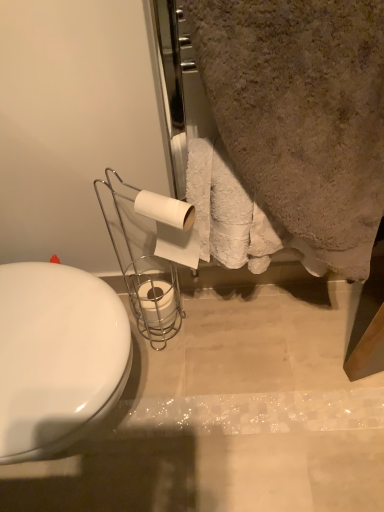
Question: Considering the relative sizes of white matte toilet paper at center, the 1th toilet paper from the back, and white matte toilet paper at center, positioned as the second toilet paper in bottom-to-top order, in the image provided, is white matte toilet paper at center, the 1th toilet paper from the back, taller than white matte toilet paper at center, positioned as the second toilet paper in bottom-to-top order,?

Choices:
 (A) no
 (B) yes

Answer: (A)

Question: Considering the relative positions of white matte toilet paper at center, which appears as the first toilet paper when ordered from the bottom, and white matte toilet paper at center, positioned as the 1th toilet paper in top-to-bottom order, in the image provided, is white matte toilet paper at center, which appears as the first toilet paper when ordered from the bottom, to the right of white matte toilet paper at center, positioned as the 1th toilet paper in top-to-bottom order, from the viewer's perspective?

Choices:
 (A) yes
 (B) no

Answer: (B)

Question: From a real-world perspective, is white matte toilet paper at center, which appears as the first toilet paper when ordered from the bottom, below white matte toilet paper at center, positioned as the second toilet paper in bottom-to-top order?

Choices:
 (A) yes
 (B) no

Answer: (A)

Question: Does white matte toilet paper at center, the 1th toilet paper from the back, have a lesser height compared to white matte toilet paper at center, positioned as the 1th toilet paper in top-to-bottom order?

Choices:
 (A) yes
 (B) no

Answer: (A)

Question: Is white matte toilet paper at center, the 1th toilet paper from the back, located outside white matte toilet paper at center, positioned as the second toilet paper in bottom-to-top order?

Choices:
 (A) yes
 (B) no

Answer: (A)

Question: Considering the positions of white glossy toilet at left and beige textured towel at upper right in the image, is white glossy toilet at left bigger or smaller than beige textured towel at upper right?

Choices:
 (A) big
 (B) small

Answer: (B)

Question: Would you say white glossy toilet at left is to the left or to the right of beige textured towel at upper right in the picture?

Choices:
 (A) left
 (B) right

Answer: (A)

Question: From a real-world perspective, is white glossy toilet at left physically located above or below beige textured towel at upper right?

Choices:
 (A) below
 (B) above

Answer: (A)

Question: Looking at their shapes, would you say white glossy toilet at left is wider or thinner than beige textured towel at upper right?

Choices:
 (A) thin
 (B) wide

Answer: (B)

Question: Does point (157, 283) appear closer or farther from the camera than point (100, 337)?

Choices:
 (A) closer
 (B) farther

Answer: (B)

Question: Is white matte toilet paper at center, the 1th toilet paper from the back, wider or thinner than white glossy toilet at left?

Choices:
 (A) wide
 (B) thin

Answer: (B)

Question: Considering the positions of white matte toilet paper at center, the 2th toilet paper in the front-to-back sequence, and white glossy toilet at left in the image, is white matte toilet paper at center, the 2th toilet paper in the front-to-back sequence, taller or shorter than white glossy toilet at left?

Choices:
 (A) short
 (B) tall

Answer: (A)

Question: From a real-world perspective, relative to white glossy toilet at left, is white matte toilet paper at center, which ranks as the 2th toilet paper in top-to-bottom order, vertically above or below?

Choices:
 (A) above
 (B) below

Answer: (B)

Question: From the image's perspective, is white glossy toilet at left above or below white matte toilet paper at center, positioned as the second toilet paper in bottom-to-top order?

Choices:
 (A) above
 (B) below

Answer: (B)

Question: Choose the correct answer: Is white glossy toilet at left inside white matte toilet paper at center, which is the first toilet paper from front to back, or outside it?

Choices:
 (A) outside
 (B) inside

Answer: (A)